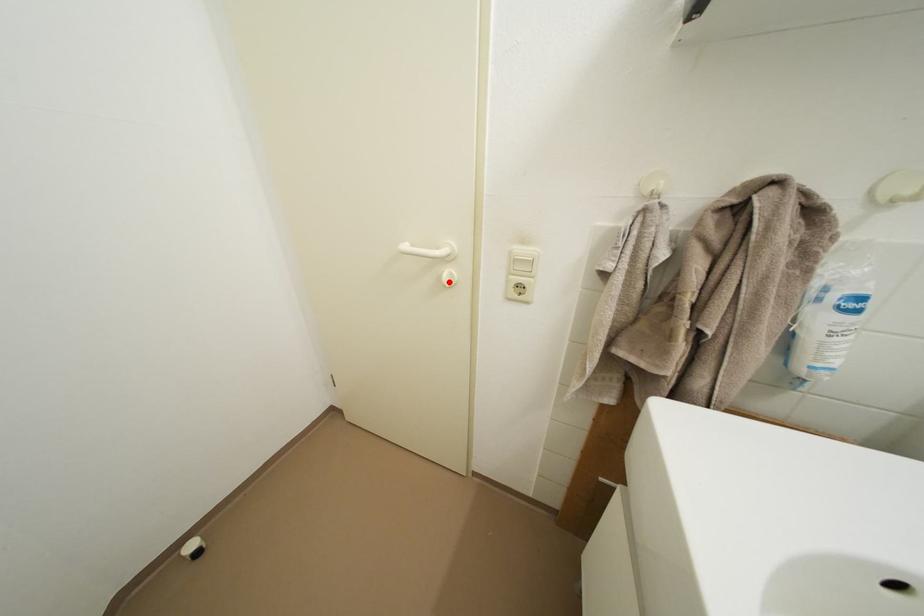
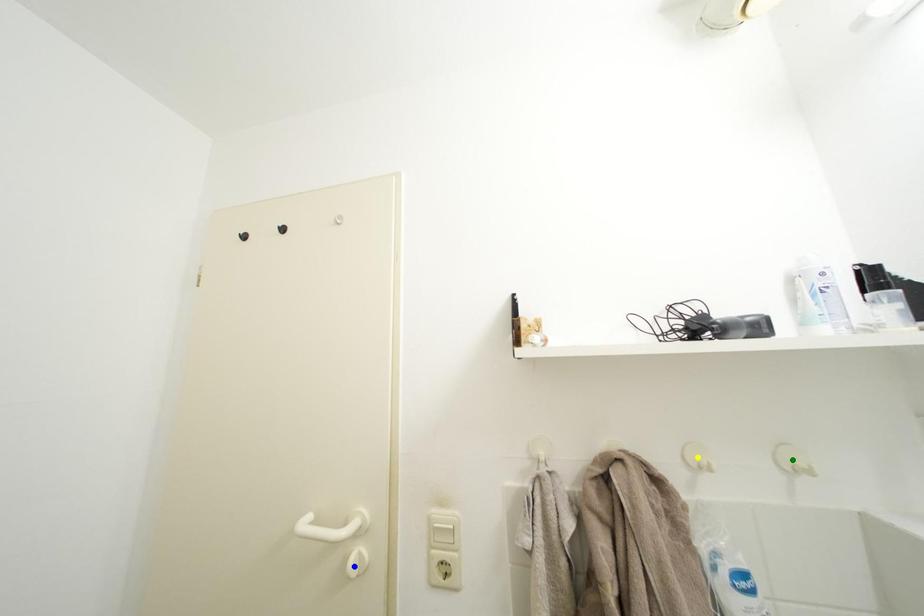
Question: I am providing you with two images of the same scene from different viewpoints. A red point is marked on the first image. You are given multiple points on the second image. In image 2, which mark is for the same physical point as the one in image 1?

Choices:
 (A) yellow point
 (B) blue point
 (C) green point

Answer: (B)